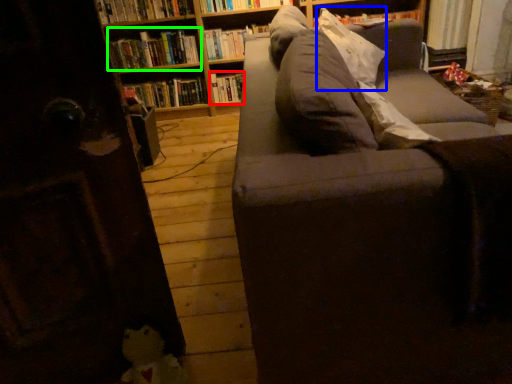
Question: Which object is positioned closest to book (highlighted by a red box)? Select from pillow (highlighted by a blue box) and book (highlighted by a green box).

Choices:
 (A) pillow
 (B) book

Answer: (B)